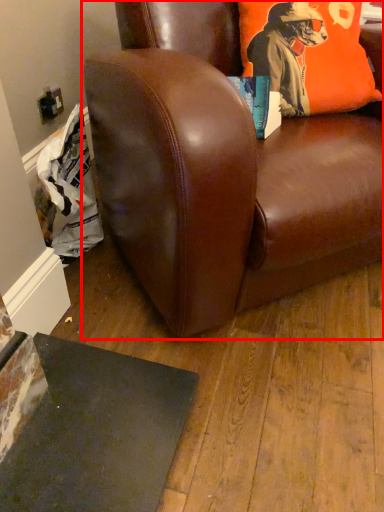
Question: Considering the relative positions of chair (annotated by the red box) and pillow in the image provided, where is chair (annotated by the red box) located with respect to the staircase?

Choices:
 (A) left
 (B) right

Answer: (A)